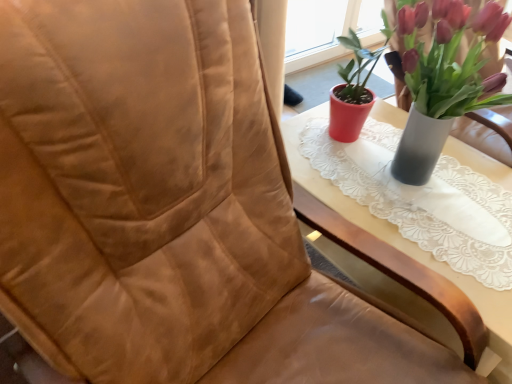
Question: Considering the positions of wooden table at center and matte red pot at upper right in the image, is wooden table at center taller or shorter than matte red pot at upper right?

Choices:
 (A) tall
 (B) short

Answer: (B)

Question: Is wooden table at center in front of or behind matte red pot at upper right in the image?

Choices:
 (A) behind
 (B) front

Answer: (A)

Question: Visually, is wooden table at center positioned to the left or to the right of matte red pot at upper right?

Choices:
 (A) right
 (B) left

Answer: (B)

Question: Does point (425, 130) appear closer or farther from the camera than point (388, 122)?

Choices:
 (A) farther
 (B) closer

Answer: (B)

Question: Relative to wooden table at center, is matte red pot at upper right in front or behind?

Choices:
 (A) behind
 (B) front

Answer: (B)

Question: From a real-world perspective, is matte red pot at upper right above or below wooden table at center?

Choices:
 (A) below
 (B) above

Answer: (B)

Question: Looking at the image, does matte red pot at upper right seem bigger or smaller compared to wooden table at center?

Choices:
 (A) big
 (B) small

Answer: (B)